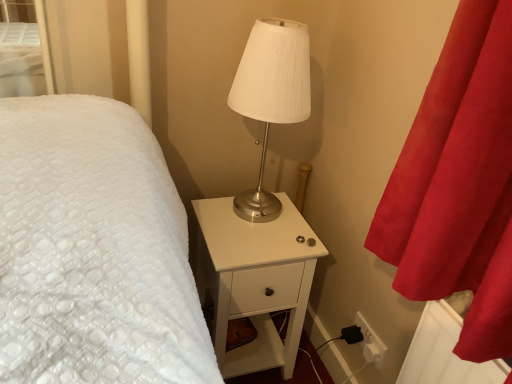
Find the location of a particular element. This screenshot has width=512, height=384. free area below satin white lamp at center (from a real-world perspective) is located at coordinates (257, 209).